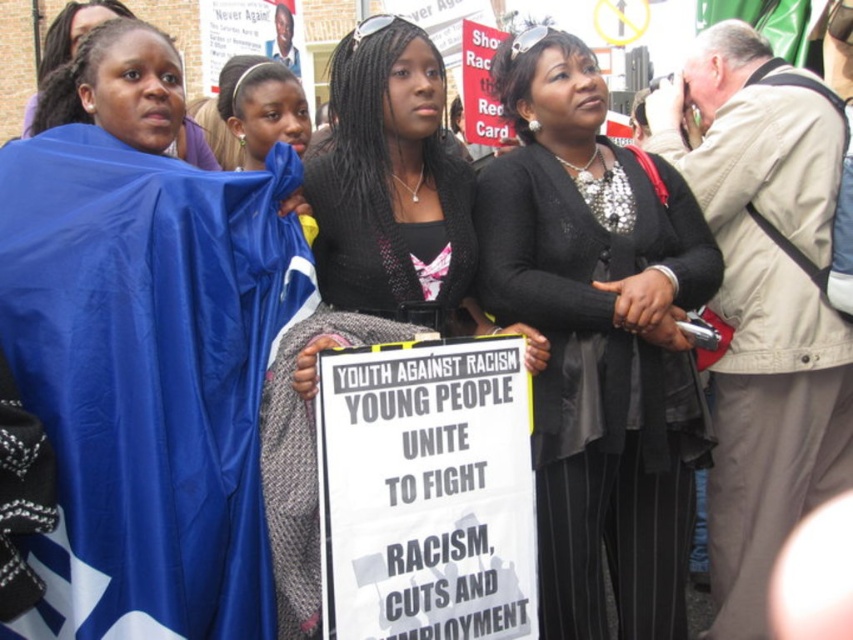
Question: Which object is closer to the camera taking this photo?

Choices:
 (A) black satin dress at center
 (B) black fabric sign at center
 (C) blue fabric at left

Answer: (C)

Question: Is blue fabric at left behind black satin dress at center?

Choices:
 (A) yes
 (B) no

Answer: (B)

Question: Which of the following is the closest to the observer?

Choices:
 (A) (653, 189)
 (B) (339, 144)

Answer: (B)

Question: Is blue fabric at left wider than black satin dress at center?

Choices:
 (A) yes
 (B) no

Answer: (A)

Question: Which of these objects is positioned farthest from the blue fabric at left?

Choices:
 (A) black fabric sign at center
 (B) black satin dress at center

Answer: (B)

Question: Is blue fabric at left bigger than black satin dress at center?

Choices:
 (A) yes
 (B) no

Answer: (A)